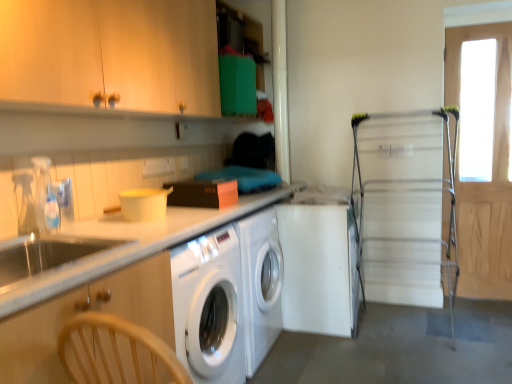
Find the location of a particular element. blank space situated above wooden screen door at right, placed as the second screen door when sorted from left to right (from a real-world perspective) is located at coordinates (481, 28).